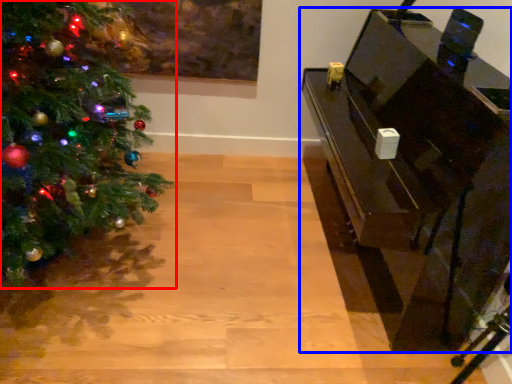
Question: Which object is closer to the camera taking this photo, christmas tree (highlighted by a red box) or furniture (highlighted by a blue box)?

Choices:
 (A) christmas tree
 (B) furniture

Answer: (A)